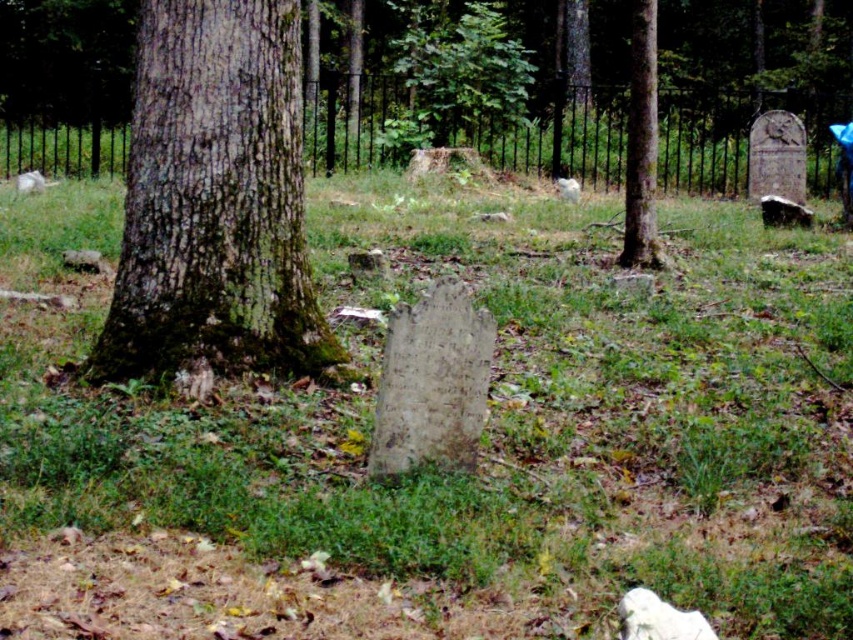
Question: Can you confirm if green mossy bark tree at left is wider than smooth bark tree at center?

Choices:
 (A) no
 (B) yes

Answer: (B)

Question: Among these points, which one is nearest to the camera?

Choices:
 (A) (633, 124)
 (B) (293, 362)

Answer: (B)

Question: Is green mossy bark tree at left above smooth bark tree at center?

Choices:
 (A) yes
 (B) no

Answer: (B)

Question: Which point is farther to the camera?

Choices:
 (A) green mossy bark tree at left
 (B) smooth bark tree at center

Answer: (B)

Question: Does green mossy bark tree at left lie in front of smooth bark tree at center?

Choices:
 (A) no
 (B) yes

Answer: (B)